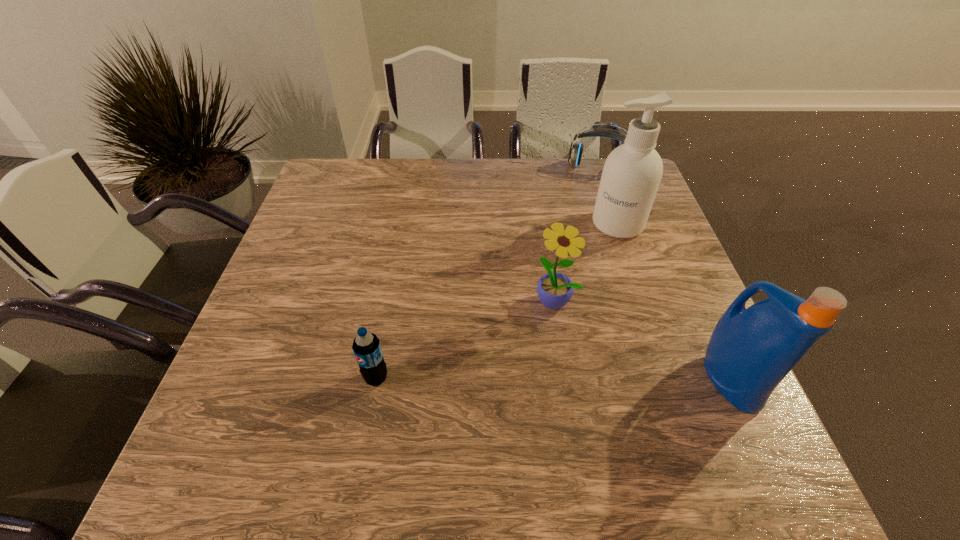
Identify the location of detergent that is at the right edge. This screenshot has height=540, width=960. (750, 352).

You are a GUI agent. You are given a task and a screenshot of the screen. Output one action in this format:
    pyautogui.click(x=<x>, y=<y>)
    Task: Click on the cleansing agent that is positioned at the right edge
    This screenshot has width=960, height=540.
    Given the screenshot: What is the action you would take?
    pyautogui.click(x=632, y=172)

At what (x,y) coordinates should I click in order to perform the action: click on headset present at the right edge. Please return your answer as a coordinate pair (x, y). The image size is (960, 540). Looking at the image, I should click on (575, 152).

Identify the location of object located at the far right corner. (575, 152).

Identify the location of object that is at the near right corner. (750, 352).

Image resolution: width=960 pixels, height=540 pixels. In the image, there is a desktop. Find the location of `free space at the far edge`. free space at the far edge is located at coordinates (571, 165).

This screenshot has width=960, height=540. Identify the location of vacant region at the near edge of the desktop. (488, 411).

I want to click on free space at the left edge, so click(266, 360).

Locate an element on the screen. The height and width of the screenshot is (540, 960). vacant space at the right edge is located at coordinates (636, 264).

Image resolution: width=960 pixels, height=540 pixels. In the image, there is a desktop. Identify the location of free space at the near left corner. (230, 391).